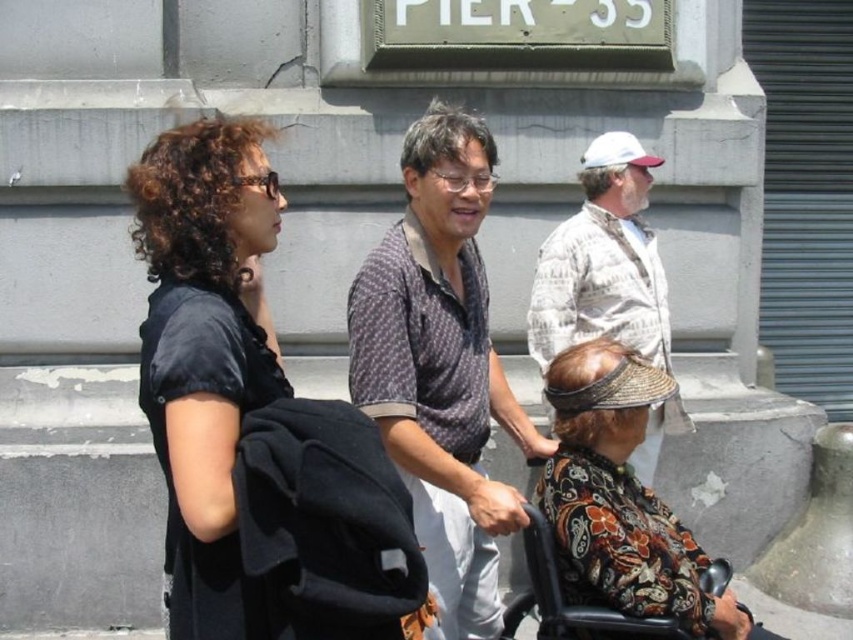
Question: Is printed fabric headscarf at lower right thinner than black plastic wheelchair at lower right?

Choices:
 (A) yes
 (B) no

Answer: (A)

Question: Where is dotted fabric shirt at center located in relation to printed fabric headscarf at lower right in the image?

Choices:
 (A) below
 (B) above

Answer: (B)

Question: Which object is the closest to the printed fabric headscarf at lower right?

Choices:
 (A) white textured shirt at upper right
 (B) black plastic wheelchair at lower right
 (C) dotted fabric shirt at center

Answer: (B)

Question: Does dotted fabric shirt at center have a lesser width compared to white textured shirt at upper right?

Choices:
 (A) yes
 (B) no

Answer: (A)

Question: Which of the following is the closest to the observer?

Choices:
 (A) black matte backpack at center
 (B) black plastic wheelchair at lower right
 (C) dotted fabric shirt at center

Answer: (A)

Question: Which object is farther from the camera taking this photo?

Choices:
 (A) dotted fabric shirt at center
 (B) black plastic wheelchair at lower right

Answer: (A)